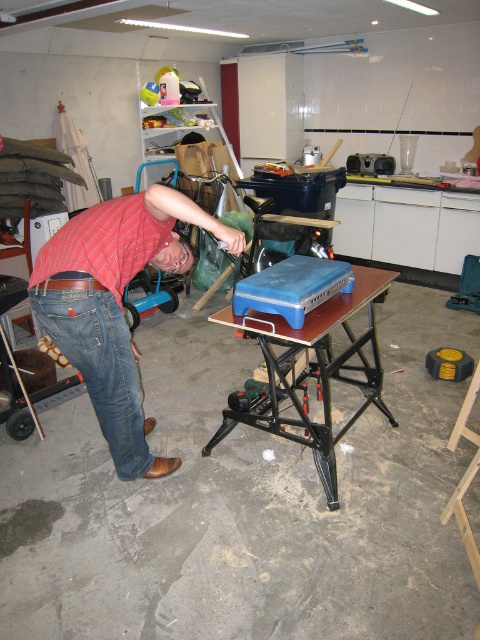
Which is in front, point (280, 346) or point (133, 460)?

Point (133, 460) is more forward.

Is blue plastic table at center wider than denim at left?

Yes.

Is point (375, 285) positioned before point (123, 339)?

No, (375, 285) is behind (123, 339).

Where is `blue plastic table at center`? blue plastic table at center is located at coordinates (310, 371).

Does red striped shirt at lower left appear under denim at left?

No, red striped shirt at lower left is not below denim at left.

Is red striped shirt at lower left shorter than denim at left?

Incorrect, red striped shirt at lower left's height does not fall short of denim at left's.

Between point (147, 234) and point (87, 328), which one is positioned behind?

Point (147, 234)

Image resolution: width=480 pixels, height=640 pixels. Identify the location of red striped shirt at lower left. [115, 305].

Can you confirm if red striped shirt at lower left is positioned to the left of blue plastic table at center?

Yes, red striped shirt at lower left is to the left of blue plastic table at center.

Which is in front, point (72, 339) or point (344, 301)?

Point (72, 339) is more forward.

The height and width of the screenshot is (640, 480). What are the coordinates of `red striped shirt at lower left` in the screenshot? It's located at (115, 305).